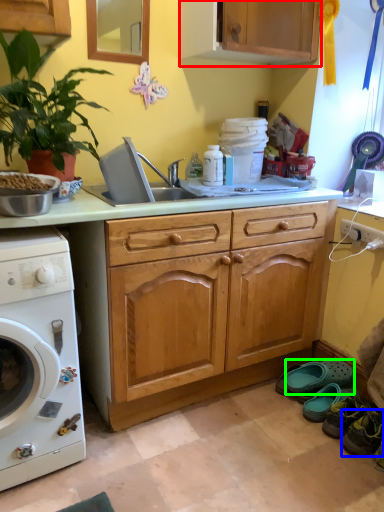
Question: Estimate the real-world distances between objects in this image. Which object is farther from cabinetry (highlighted by a red box), shoe (highlighted by a blue box) or shoe (highlighted by a green box)?

Choices:
 (A) shoe
 (B) shoe

Answer: (A)